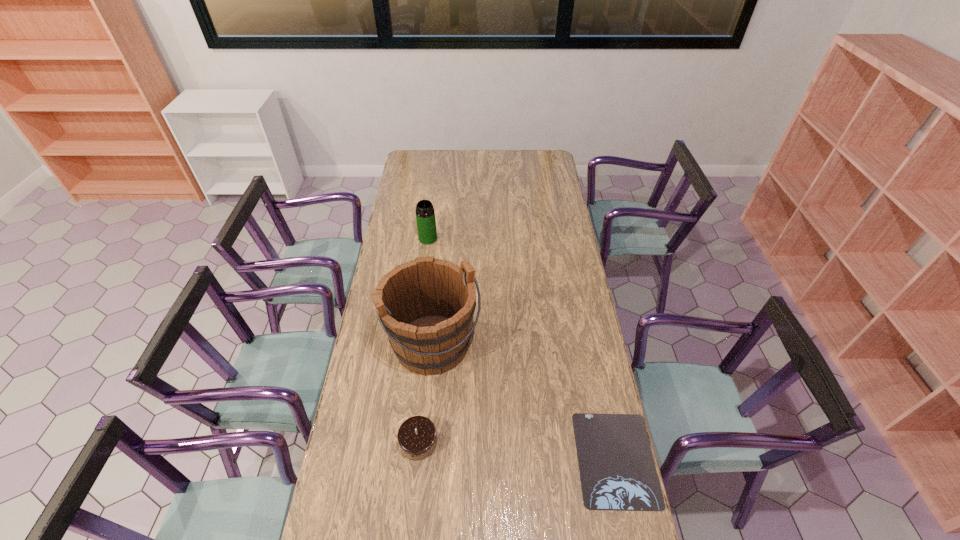
Find the location of a particular element. The width and height of the screenshot is (960, 540). free space at the far edge of the desktop is located at coordinates (434, 168).

Where is `free space at the near edge`? free space at the near edge is located at coordinates (541, 518).

Where is `free region at the left edge`? The image size is (960, 540). free region at the left edge is located at coordinates (407, 199).

Find the location of `vacant space at the right edge of the desktop`. vacant space at the right edge of the desktop is located at coordinates (549, 201).

Find the location of a particular element. vacant area at the near left corner is located at coordinates (327, 519).

This screenshot has height=540, width=960. What are the coordinates of `blank space at the far right corner of the desktop` in the screenshot? It's located at 553,157.

The image size is (960, 540). Find the location of `vacant space in between the wine bucket and the shortest object`. vacant space in between the wine bucket and the shortest object is located at coordinates (524, 401).

Identify the location of free point between the second farthest object and the shortest object. (524, 401).

I want to click on empty space that is in between the rightmost object and the second shortest object, so click(517, 450).

At what (x,y) coordinates should I click in order to perform the action: click on vacant area that lies between the wine bucket and the third tallest object. Please return your answer as a coordinate pair (x, y). This screenshot has height=540, width=960. Looking at the image, I should click on (426, 393).